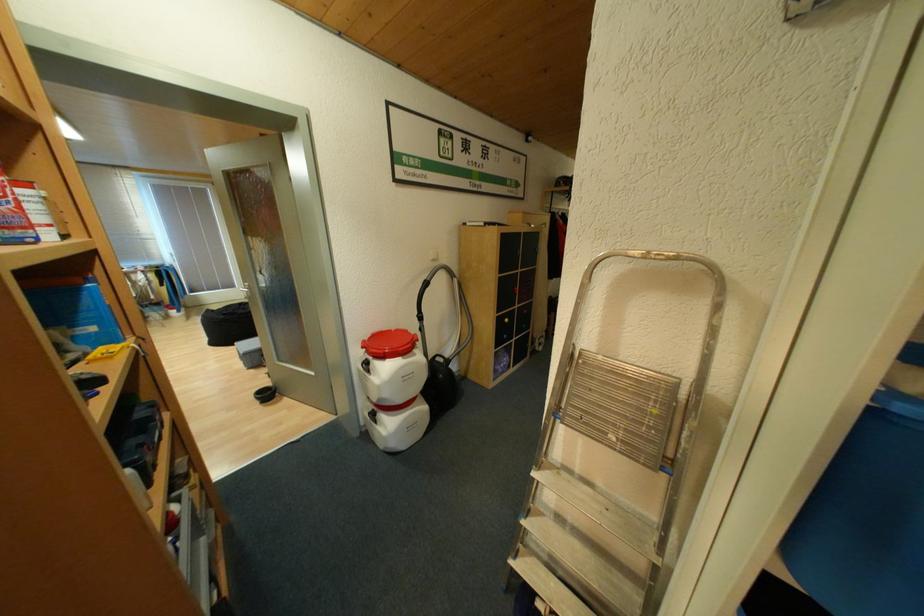
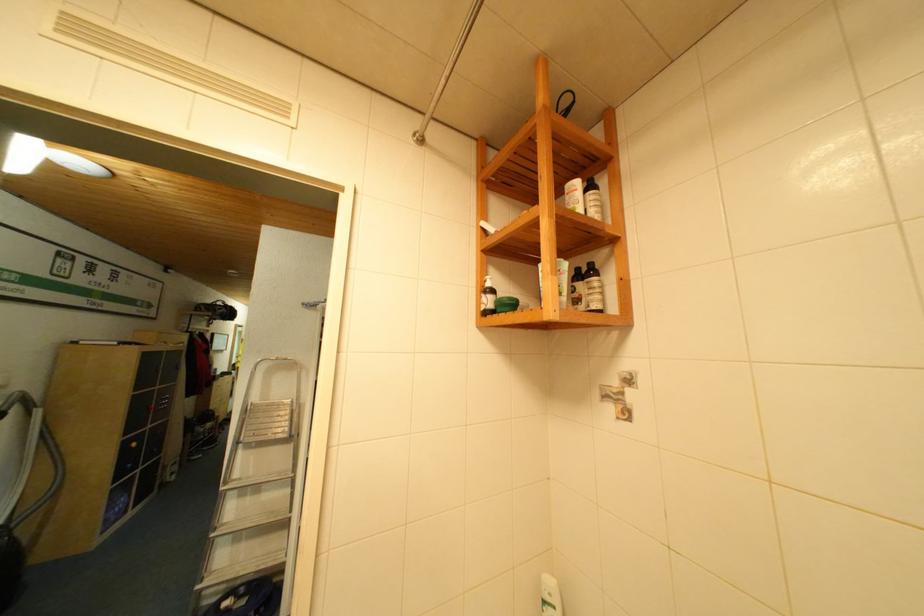
Find the pixel in the second image that matches pixel 507 321 in the first image.

(136, 445)